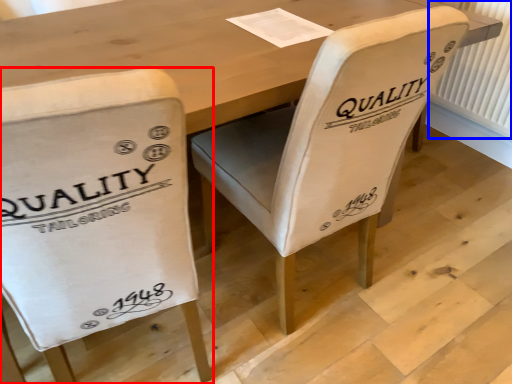
Question: Which of the following is the closest to the observer, chair (highlighted by a red box) or radiator (highlighted by a blue box)?

Choices:
 (A) chair
 (B) radiator

Answer: (A)